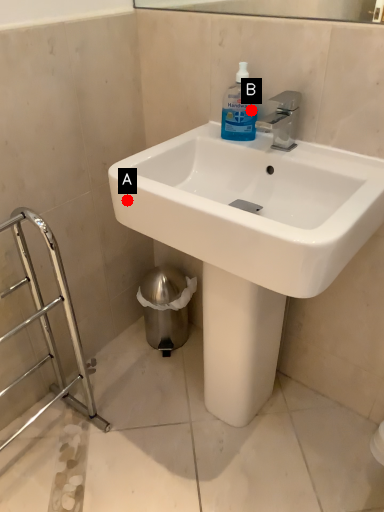
Question: Two points are circled on the image, labeled by A and B beside each circle. Which point is closer to the camera?

Choices:
 (A) A is closer
 (B) B is closer

Answer: (A)